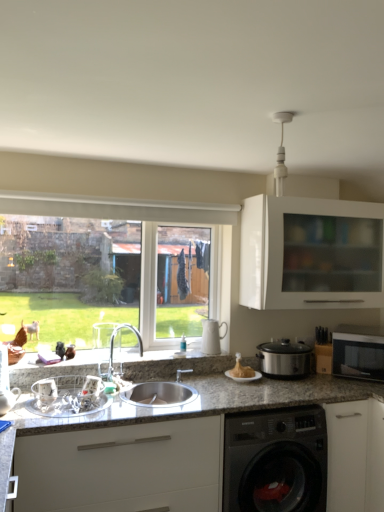
Question: From a real-world perspective, is clear glass window at center positioned over white glossy cabinet at upper right, acting as the second cabinetry starting from the bottom, based on gravity?

Choices:
 (A) yes
 (B) no

Answer: (B)

Question: Is clear glass window at center aimed at white glossy cabinet at upper right, the 1th cabinetry from the back?

Choices:
 (A) yes
 (B) no

Answer: (B)

Question: Is clear glass window at center touching white glossy cabinet at upper right, the first cabinetry in the right-to-left sequence?

Choices:
 (A) yes
 (B) no

Answer: (B)

Question: From the image's perspective, is clear glass window at center beneath white glossy cabinet at upper right, the first cabinetry in the right-to-left sequence?

Choices:
 (A) no
 (B) yes

Answer: (B)

Question: Considering the relative sizes of clear glass window at center and white glossy cabinet at upper right, placed as the second cabinetry when sorted from left to right, in the image provided, is clear glass window at center smaller than white glossy cabinet at upper right, placed as the second cabinetry when sorted from left to right,?

Choices:
 (A) no
 (B) yes

Answer: (B)

Question: Does clear glass window at center have a lesser width compared to white glossy cabinet at upper right, marked as the 1th cabinetry in a top-to-bottom arrangement?

Choices:
 (A) yes
 (B) no

Answer: (A)

Question: Can you confirm if silver metallic faucet at center is shorter than metallic silver dish rack at sink, which is counted as the second appliance, starting from the left?

Choices:
 (A) no
 (B) yes

Answer: (A)

Question: Is silver metallic faucet at center positioned in front of metallic silver dish rack at sink, arranged as the second appliance when viewed from the right?

Choices:
 (A) yes
 (B) no

Answer: (B)

Question: From a real-world perspective, is silver metallic faucet at center on top of metallic silver dish rack at sink, which is counted as the second appliance, starting from the left?

Choices:
 (A) yes
 (B) no

Answer: (A)

Question: From the image's perspective, is silver metallic faucet at center located beneath metallic silver dish rack at sink, which is counted as the second appliance, starting from the left?

Choices:
 (A) yes
 (B) no

Answer: (B)

Question: Is silver metallic faucet at center not inside metallic silver dish rack at sink, positioned as the 1th appliance in front-to-back order?

Choices:
 (A) yes
 (B) no

Answer: (A)

Question: Is silver metallic faucet at center at the right side of metallic silver dish rack at sink, arranged as the second appliance when viewed from the right?

Choices:
 (A) yes
 (B) no

Answer: (A)